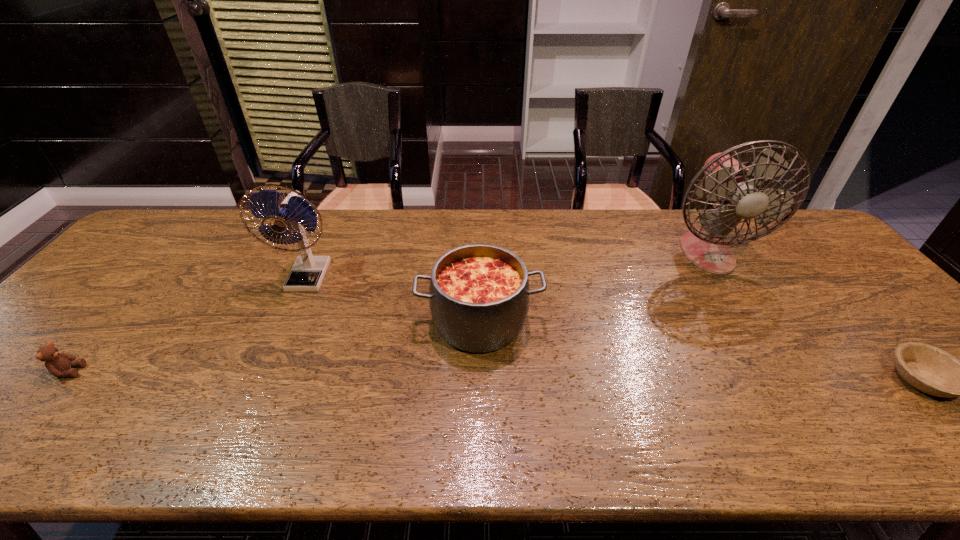
Where is `vacant region between the left fan and the third tallest object`? vacant region between the left fan and the third tallest object is located at coordinates (394, 299).

At what (x,y) coordinates should I click in order to perform the action: click on vacant region between the third shortest object and the fourth object from right to left. Please return your answer as a coordinate pair (x, y). The height and width of the screenshot is (540, 960). Looking at the image, I should click on (394, 299).

This screenshot has width=960, height=540. I want to click on unoccupied position between the fourth object from right to left and the second shortest object, so click(189, 324).

Where is `vacant area between the third object from left to right and the leftmost object`? vacant area between the third object from left to right and the leftmost object is located at coordinates (275, 346).

Where is `vacant region between the second shortest object and the right fan`? The width and height of the screenshot is (960, 540). vacant region between the second shortest object and the right fan is located at coordinates (388, 312).

Identify the location of vacant space that's between the taller fan and the casserole. This screenshot has width=960, height=540. (593, 287).

Identify which object is the second closest to the fourth tallest object. Please provide its 2D coordinates. Your answer should be formatted as a tuple, i.e. [(x, y)], where the tuple contains the x and y coordinates of a point satisfying the conditions above.

[(479, 296)]

Select which object is the second closest to the casserole. Please provide its 2D coordinates. Your answer should be formatted as a tuple, i.e. [(x, y)], where the tuple contains the x and y coordinates of a point satisfying the conditions above.

[(728, 182)]

The height and width of the screenshot is (540, 960). Find the location of `vacant region that satisfies the following two spatial constraints: 1. on the front-facing side of the second tallest object; 2. on the right side of the third shortest object`. vacant region that satisfies the following two spatial constraints: 1. on the front-facing side of the second tallest object; 2. on the right side of the third shortest object is located at coordinates (288, 321).

The width and height of the screenshot is (960, 540). Identify the location of free location that satisfies the following two spatial constraints: 1. in front of the tallest object to direct airflow; 2. on the face of the fourth tallest object. (781, 371).